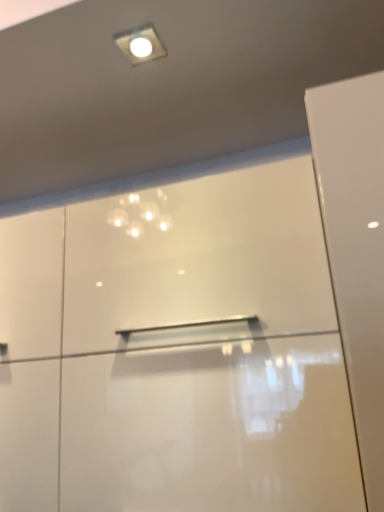
Identify the location of unoccupied space behind white glossy droplight at upper center. This screenshot has width=384, height=512. (147, 92).